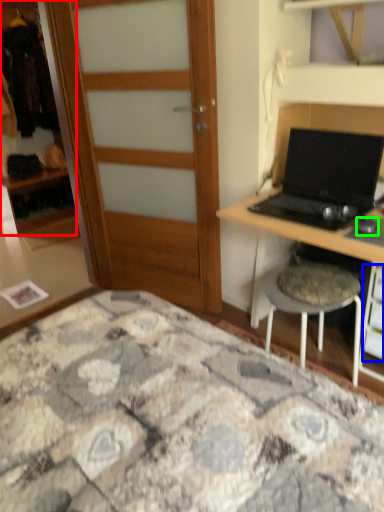
Question: Considering the real-world distances, which object is closest to cabinetry (highlighted by a red box)? drawer (highlighted by a blue box) or mouse (highlighted by a green box).

Choices:
 (A) drawer
 (B) mouse

Answer: (A)